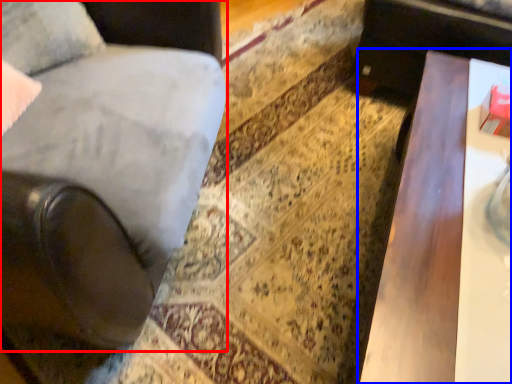
Question: Which object appears closest to the camera in this image, chair (highlighted by a red box) or table (highlighted by a blue box)?

Choices:
 (A) chair
 (B) table

Answer: (A)